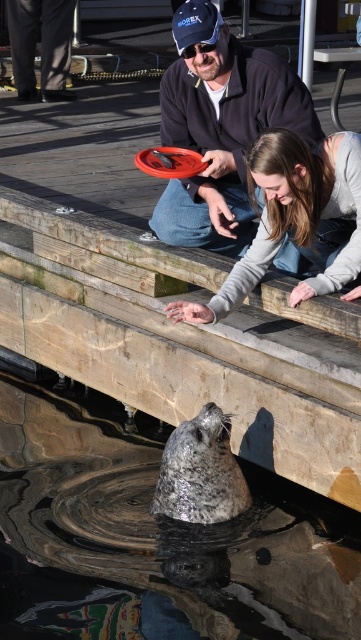
You are a visitor at the sanctuary and want to take a photo of the wooden at center and matte black pants at upper left. Which object should you focus on first if you want to capture both in the same frame without moving your camera?

The wooden at center is taller than matte black pants at upper left, so you should focus on the wooden at center first to ensure it is in frame before adjusting for the matte black pants at upper left.

You are a visitor at the sanctuary and want to toss the matte black frisbee at upper center into the grayish water at seal center. Can you determine if the frisbee will fit entirely within the water area?

The grayish water at seal center has a larger width than the matte black frisbee at upper center, so the frisbee will fit entirely within the water area.